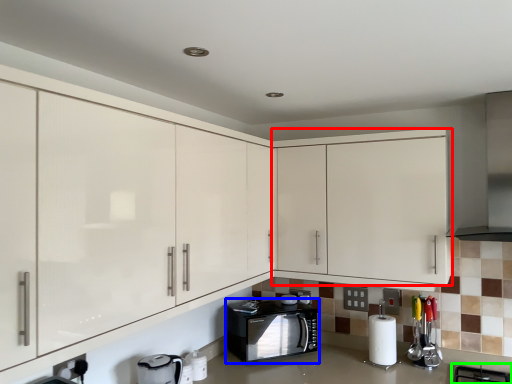
Question: Which object is the closest to the cabinetry (highlighted by a red box)? Choose among these: home appliance (highlighted by a blue box) or gas stove (highlighted by a green box).

Choices:
 (A) home appliance
 (B) gas stove

Answer: (A)